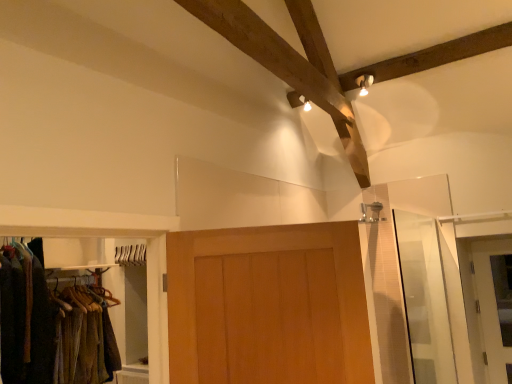
Question: Is the position of white glossy door at right, placed as the first door when sorted from right to left, less distant than that of transparent glass screen door at right?

Choices:
 (A) yes
 (B) no

Answer: (B)

Question: Is white glossy door at right, the second door viewed from the front, touching transparent glass screen door at right?

Choices:
 (A) no
 (B) yes

Answer: (A)

Question: Does white glossy door at right, which is counted as the 1th door, starting from the back, have a lesser height compared to transparent glass screen door at right?

Choices:
 (A) yes
 (B) no

Answer: (A)

Question: Would you say white glossy door at right, positioned as the 2th door in left-to-right order, is outside transparent glass screen door at right?

Choices:
 (A) yes
 (B) no

Answer: (A)

Question: Considering the relative sizes of white glossy door at right, which is counted as the 1th door, starting from the back, and transparent glass screen door at right in the image provided, is white glossy door at right, which is counted as the 1th door, starting from the back, smaller than transparent glass screen door at right?

Choices:
 (A) no
 (B) yes

Answer: (B)

Question: Do you think transparent glass screen door at right is within white glossy door at right, positioned as the 2th door in left-to-right order, or outside of it?

Choices:
 (A) outside
 (B) inside

Answer: (A)

Question: Is transparent glass screen door at right to the left or to the right of white glossy door at right, placed as the first door when sorted from right to left, in the image?

Choices:
 (A) right
 (B) left

Answer: (B)

Question: From a real-world perspective, is transparent glass screen door at right positioned above or below white glossy door at right, which is counted as the 1th door, starting from the back?

Choices:
 (A) below
 (B) above

Answer: (B)

Question: Looking at their shapes, would you say transparent glass screen door at right is wider or thinner than white glossy door at right, which is counted as the 1th door, starting from the back?

Choices:
 (A) thin
 (B) wide

Answer: (B)

Question: Is point (233, 281) positioned closer to the camera than point (488, 291)?

Choices:
 (A) closer
 (B) farther

Answer: (A)

Question: Looking at the image, does wooden door at center, the 2th door in the back-to-front sequence, seem bigger or smaller compared to white glossy door at right, placed as the first door when sorted from right to left?

Choices:
 (A) big
 (B) small

Answer: (A)

Question: From the image's perspective, relative to white glossy door at right, placed as the first door when sorted from right to left, is wooden door at center, the first door in the front-to-back sequence, above or below?

Choices:
 (A) above
 (B) below

Answer: (A)

Question: Is wooden door at center, placed as the first door when sorted from left to right, taller or shorter than white glossy door at right, placed as the first door when sorted from right to left?

Choices:
 (A) tall
 (B) short

Answer: (B)

Question: From the image's perspective, is white glossy door at right, positioned as the 2th door in left-to-right order, above or below wooden door at center, the 2th door in the back-to-front sequence?

Choices:
 (A) below
 (B) above

Answer: (A)

Question: In terms of width, does white glossy door at right, positioned as the 2th door in left-to-right order, look wider or thinner when compared to wooden door at center, the 2th door in the back-to-front sequence?

Choices:
 (A) wide
 (B) thin

Answer: (B)